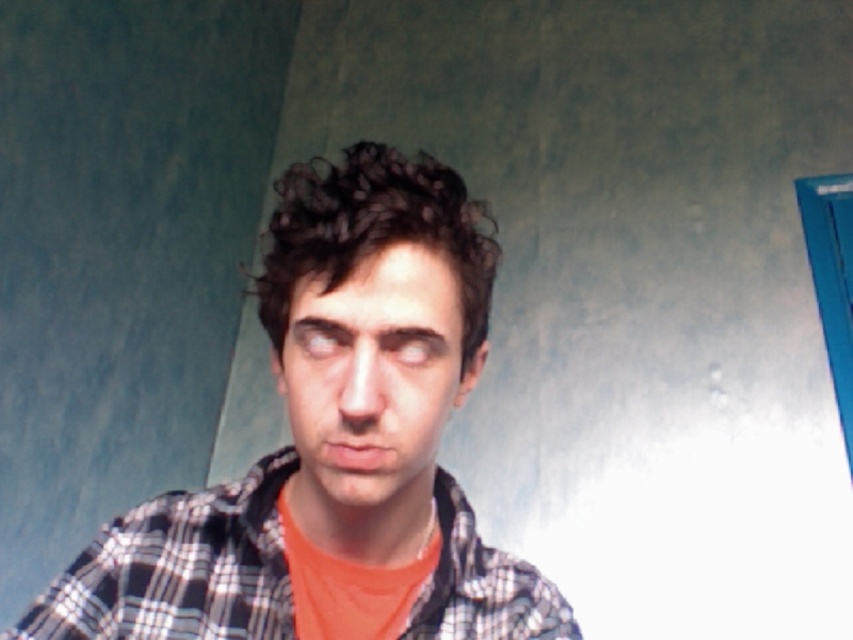
You are organizing a clothing donation drive and need to sort items by type. You see the plaid shirt at center and the plaid cotton shirt at center in the image. Which one should be categorized under the cotton category?

The plaid cotton shirt at center should be categorized under the cotton category because it explicitly mentions cotton in its description, while the plaid shirt at center does not specify the material.

You are trying to decide between two shirts to wear. You have a plaid shirt at center and a plaid cotton shirt at center. Which one is wider?

The plaid shirt at center is wider than the plaid cotton shirt at center according to the description.